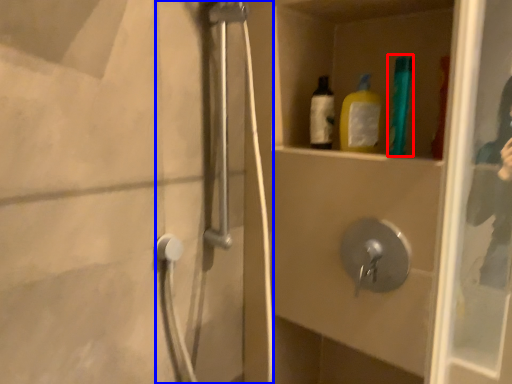
Question: Which point is closer to the camera, bottle (highlighted by a red box) or shower door (highlighted by a blue box)?

Choices:
 (A) bottle
 (B) shower door

Answer: (B)